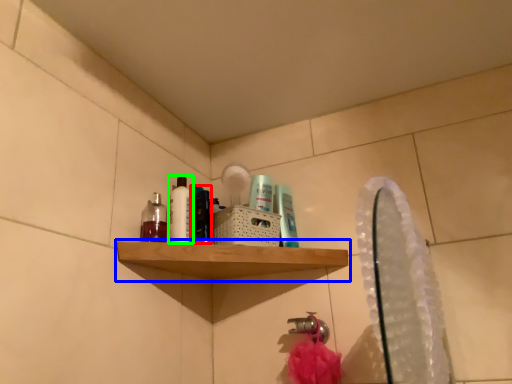
Question: Estimate the real-world distances between objects in this image. Which object is closer to mouthwash (highlighted by a red box), shelf (highlighted by a blue box) or cleaning product (highlighted by a green box)?

Choices:
 (A) shelf
 (B) cleaning product

Answer: (B)